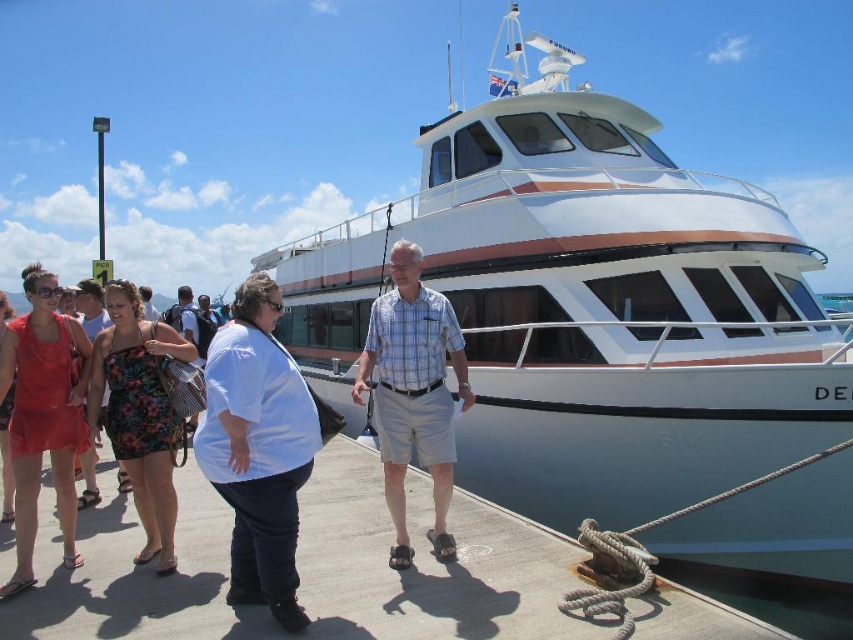
Between point (833, 403) and point (254, 288), which one is positioned in front?

Positioned in front is point (254, 288).

The image size is (853, 640). I want to click on white glossy boat at center, so click(589, 305).

Does point (761, 536) come farther from viewer compared to point (241, 500)?

Yes, it is.

Find the location of a particular element. Image resolution: width=853 pixels, height=640 pixels. white glossy boat at center is located at coordinates (589, 305).

Image resolution: width=853 pixels, height=640 pixels. What do you see at coordinates (413, 394) in the screenshot?
I see `plaid shirt at center` at bounding box center [413, 394].

Between point (398, 541) and point (138, 451), which one is positioned in front?

Point (398, 541)

This screenshot has height=640, width=853. What are the coordinates of `plaid shirt at center` in the screenshot? It's located at (413, 394).

Who is lower down, white matte shirt at center or matte red dress at lower left?

Positioned lower is white matte shirt at center.

From the picture: Which is above, white matte shirt at center or matte red dress at lower left?

matte red dress at lower left is higher up.

Where is `white matte shirt at center`? The width and height of the screenshot is (853, 640). white matte shirt at center is located at coordinates (258, 449).

You are a GUI agent. You are given a task and a screenshot of the screen. Output one action in this format:
    pyautogui.click(x=<x>, y=<y>)
    Task: Click on the white matte shirt at center
    This screenshot has width=853, height=640.
    Given the screenshot: What is the action you would take?
    pyautogui.click(x=258, y=449)